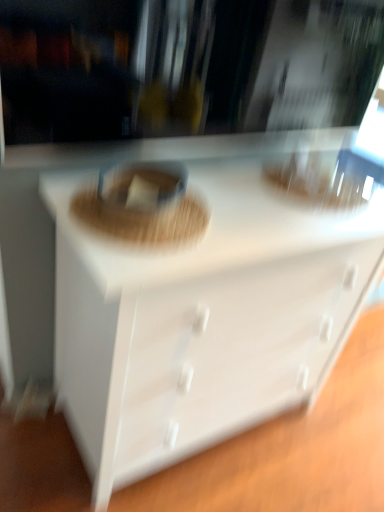
You are a GUI agent. You are given a task and a screenshot of the screen. Output one action in this format:
    pyautogui.click(x=<x>, y=<y>)
    Task: Click on the empty space that is ontop of white glossy chest of drawers at center (from a real-world perspective)
    The width and height of the screenshot is (384, 512).
    Given the screenshot: What is the action you would take?
    pyautogui.click(x=263, y=181)